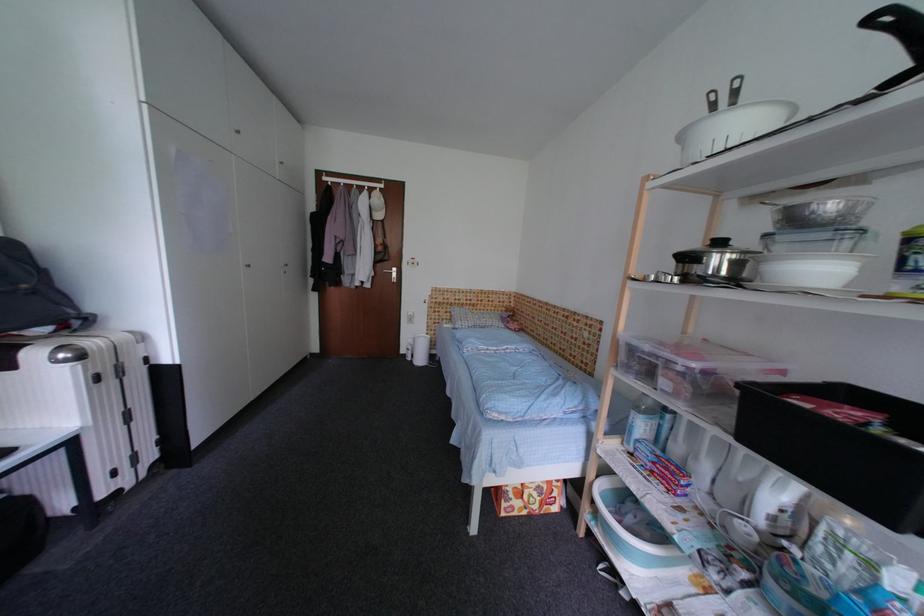
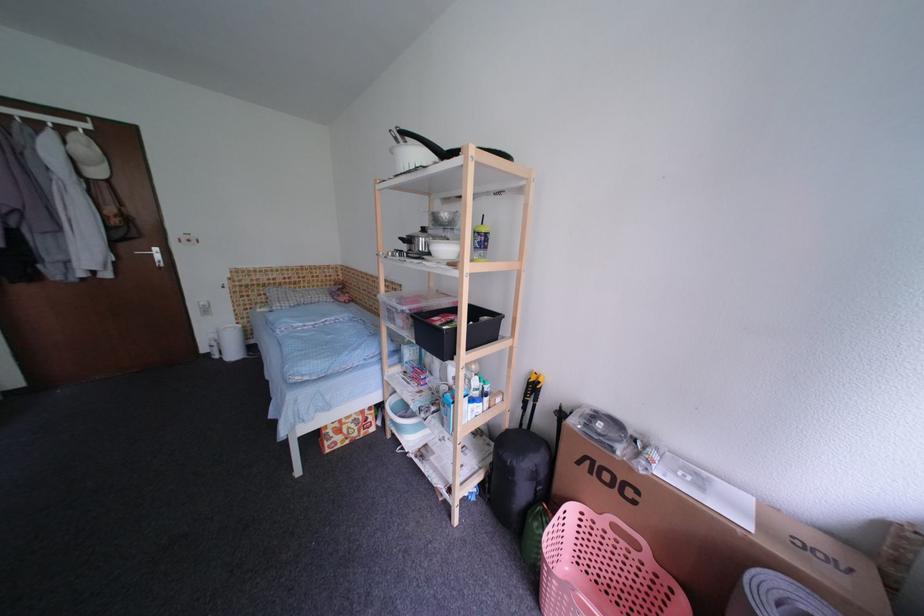
Question: The first image is from the beginning of the video and the second image is from the end. How did the camera likely rotate when shooting the video?

Choices:
 (A) Left
 (B) Right
 (C) Up
 (D) Down

Answer: (B)